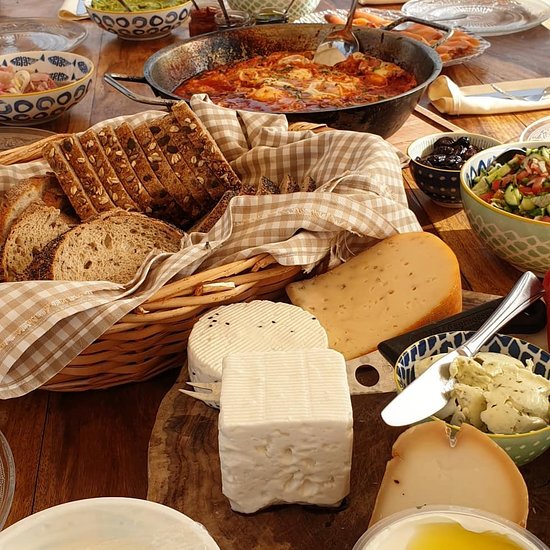
The height and width of the screenshot is (550, 550). Find the location of `basket`. basket is located at coordinates (148, 343).